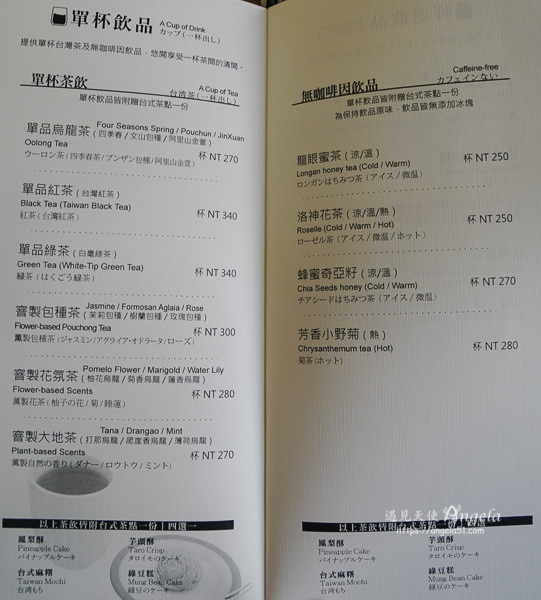
Where is `cup`? This screenshot has width=541, height=600. cup is located at coordinates (79, 492).